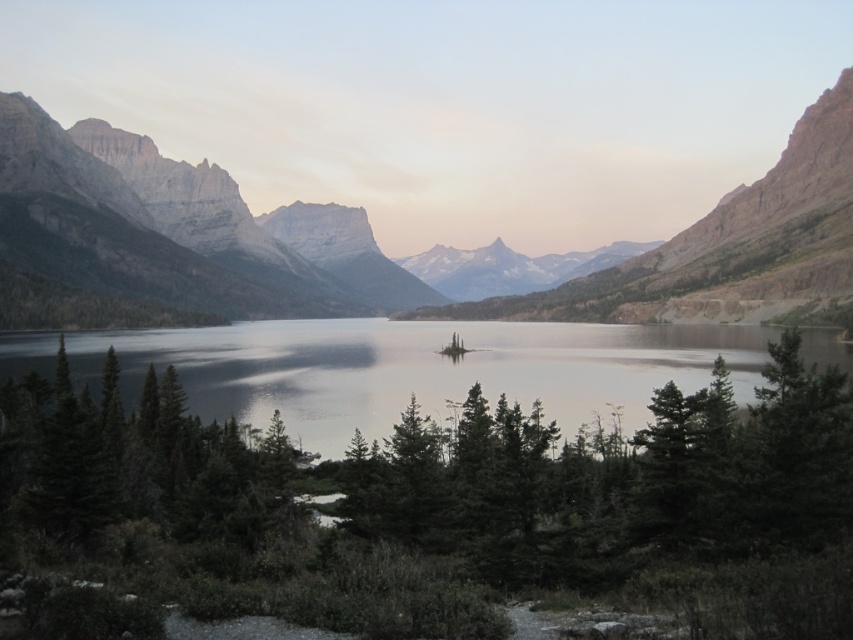
Is green matte tree at center wider than clear water at center?

No, green matte tree at center is not wider than clear water at center.

Is green matte tree at center to the left of clear water at center from the viewer's perspective?

No, green matte tree at center is not to the left of clear water at center.

Which is in front, point (799, 484) or point (630, 378)?

Point (799, 484) is more forward.

Where is `green matte tree at center`? The width and height of the screenshot is (853, 640). green matte tree at center is located at coordinates (444, 500).

Is point (548, 515) closer to camera compared to point (61, 308)?

Yes.

Which is more to the left, green matte tree at center or matte gray rock at center?

matte gray rock at center

Does point (782, 468) come farther from viewer compared to point (28, 282)?

No, it is in front of (28, 282).

What are the coordinates of `green matte tree at center` in the screenshot? It's located at (444, 500).

Is matte gray rock at center to the right of clear water at center from the viewer's perspective?

Incorrect, matte gray rock at center is not on the right side of clear water at center.

I want to click on matte gray rock at center, so click(374, 241).

Image resolution: width=853 pixels, height=640 pixels. I want to click on matte gray rock at center, so click(x=374, y=241).

This screenshot has width=853, height=640. What are the coordinates of `matte gray rock at center` in the screenshot? It's located at (374, 241).